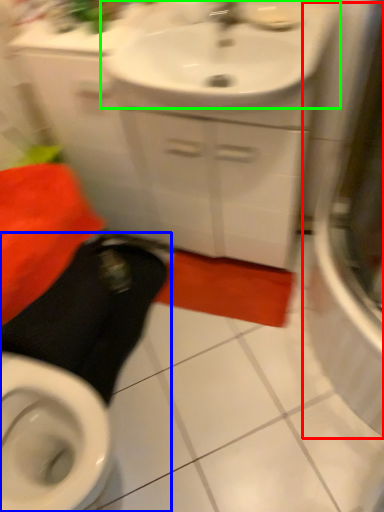
Question: Based on their relative distances, which object is nearer to screen door (highlighted by a red box)? Choose from squat (highlighted by a blue box) and sink (highlighted by a green box).

Choices:
 (A) squat
 (B) sink

Answer: (B)